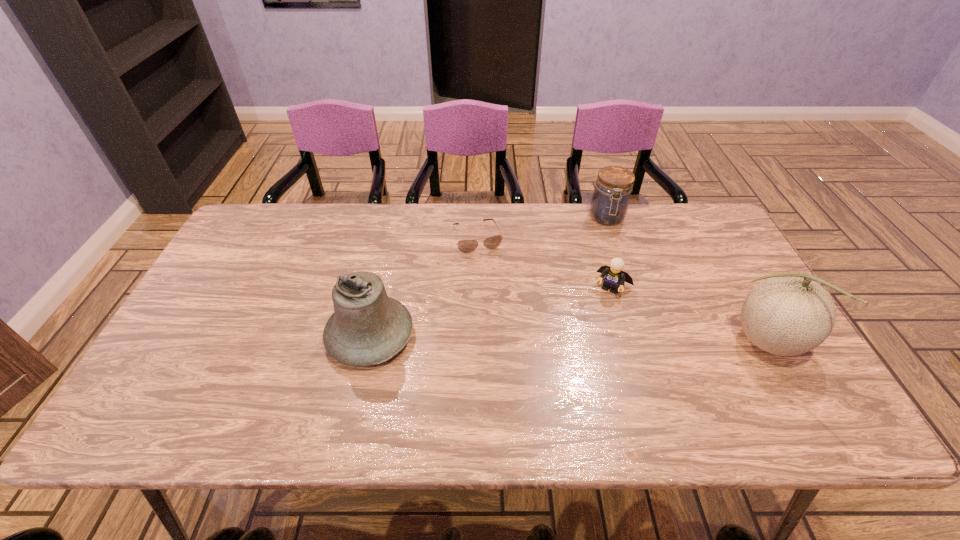
Where is `sunglasses present at the far edge`? The image size is (960, 540). sunglasses present at the far edge is located at coordinates (466, 246).

Where is `jar that is at the far edge`? jar that is at the far edge is located at coordinates (610, 200).

What are the coordinates of `bell present at the near edge` in the screenshot? It's located at (367, 327).

The height and width of the screenshot is (540, 960). In order to click on cantaloup that is at the near edge in this screenshot , I will do `click(788, 314)`.

This screenshot has width=960, height=540. I want to click on object located in the right edge section of the desktop, so click(x=788, y=314).

The image size is (960, 540). I want to click on object at the near right corner, so click(788, 314).

Locate an element on the screen. This screenshot has width=960, height=540. vacant space at the far edge is located at coordinates (332, 212).

Locate an element on the screen. Image resolution: width=960 pixels, height=540 pixels. vacant space at the near edge of the desktop is located at coordinates (326, 377).

In order to click on free space at the left edge of the desktop in this screenshot , I will do `click(228, 253)`.

Locate an element on the screen. vacant space at the near left corner is located at coordinates (202, 369).